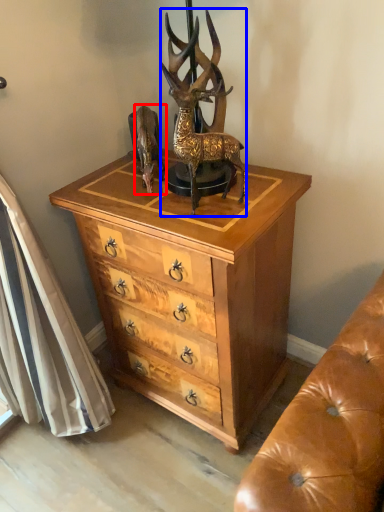
Question: Which object appears closest to the camera in this image, animal (highlighted by a red box) or deer (highlighted by a blue box)?

Choices:
 (A) animal
 (B) deer

Answer: (B)